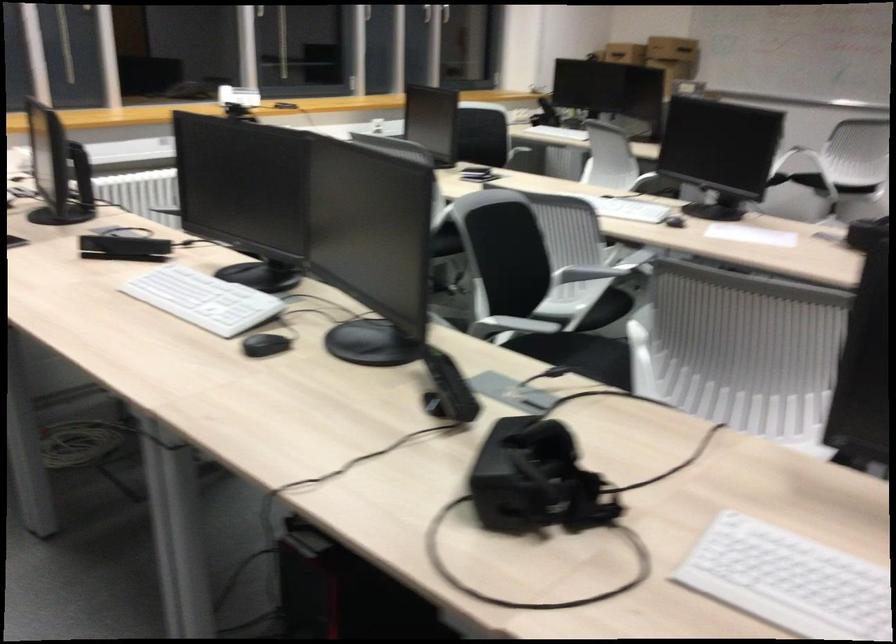
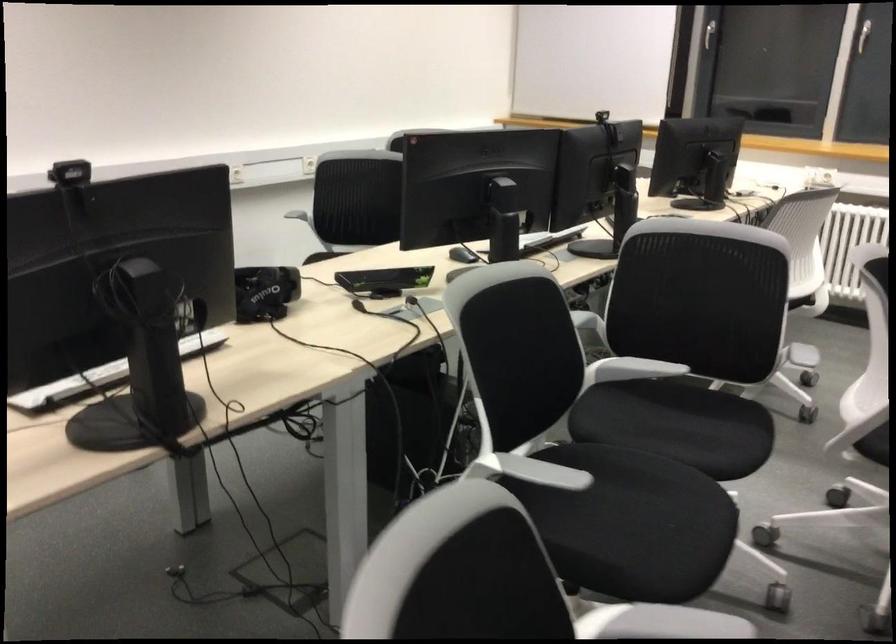
Find the pixel in the second image that matches point (252, 343) in the first image.

(462, 254)